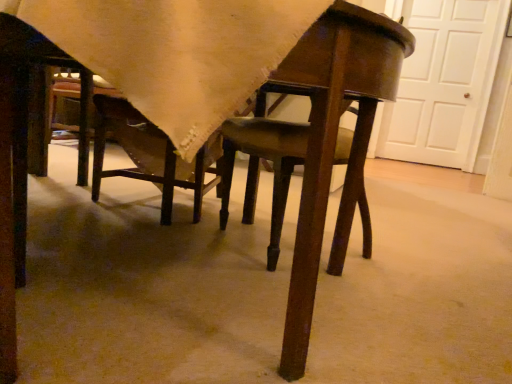
What is the approximate width of white matte door at upper right?

The width of white matte door at upper right is 5.88 inches.

I want to click on white matte door at upper right, so click(444, 82).

The height and width of the screenshot is (384, 512). What do you see at coordinates (444, 82) in the screenshot?
I see `white matte door at upper right` at bounding box center [444, 82].

This screenshot has height=384, width=512. In order to click on white matte door at upper right in this screenshot , I will do `click(444, 82)`.